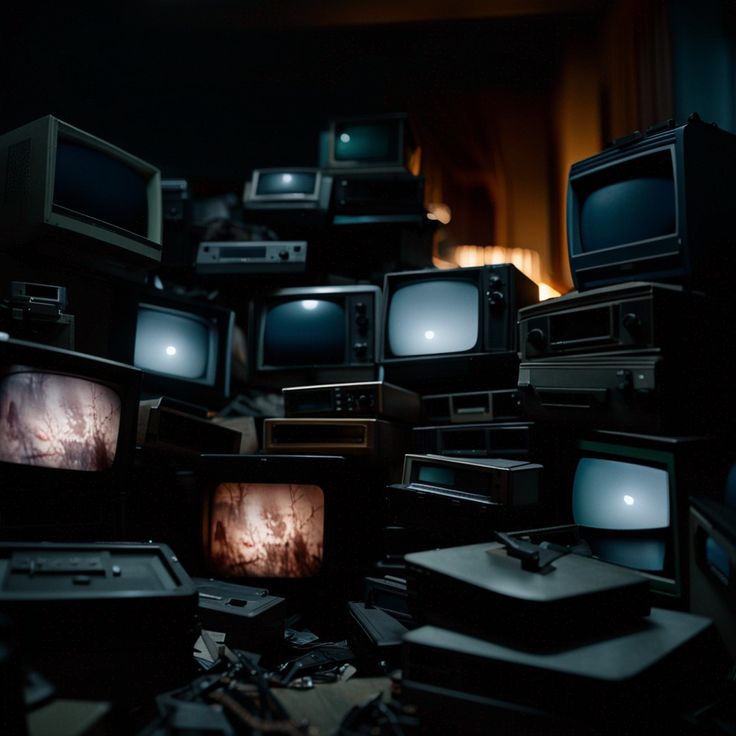
Locate an element on the screen. The width and height of the screenshot is (736, 736). tvs is located at coordinates (174, 333), (82, 428), (104, 191), (275, 180), (358, 146), (601, 208), (459, 316), (311, 333), (620, 506), (290, 551).